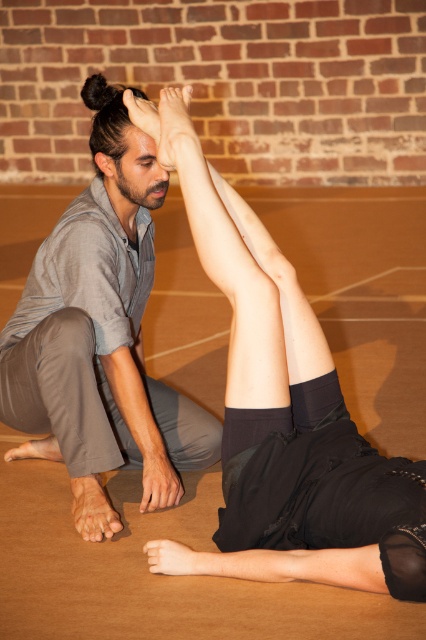
You are a photographer setting up for a photo shoot. You need to position a light so that it illuminates the smooth skin leg at center and the gray cotton shirt at left without casting shadows on the brick wall behind them. Based on their positions, where should you place the light relative to the two objects?

The smooth skin leg at center is to the right of the gray cotton shirt at left. To avoid casting shadows on the brick wall, the light should be placed to the right side of the smooth skin leg at center, ensuring both objects are illuminated while the shadows fall away from the wall.

From the picture: You are a photographer positioned at the back of the room. You want to capture a photo where both the smooth skin leg at center and the gray cotton shirt at left are clearly visible. Which object should you focus on first to ensure both are in focus?

You should focus on the gray cotton shirt at left first because it is farther away from the viewer compared to the smooth skin leg at center, ensuring both will be in focus when focusing on the farther object.